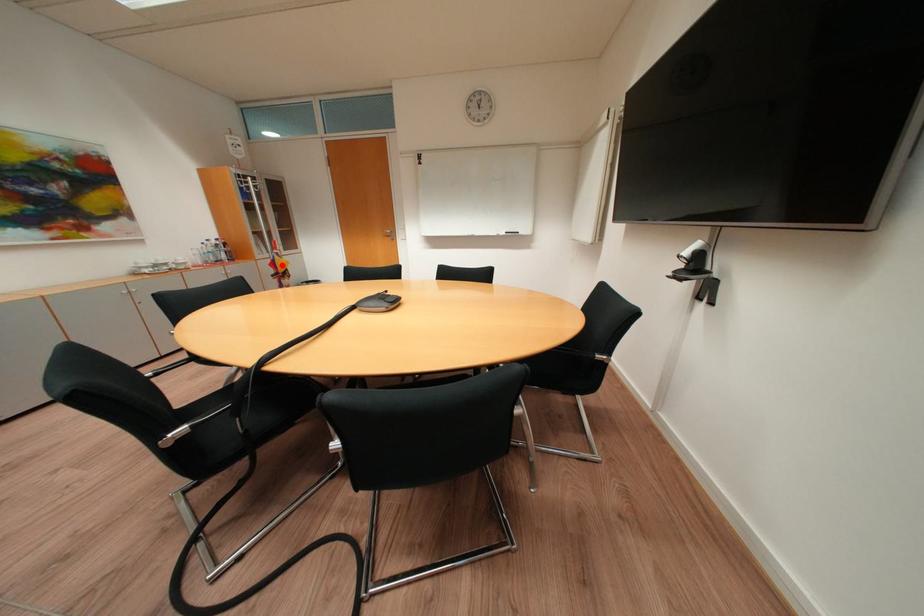
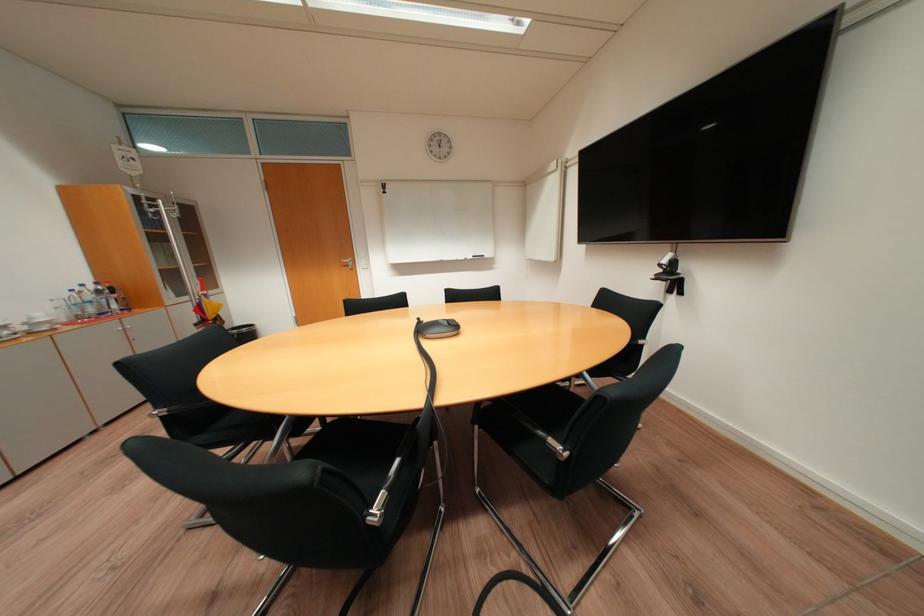
Question: I am providing you with two images of the same scene from different viewpoints. A red point is shown in image1. For the corresponding object point in image2, is it positioned nearer or farther from the camera?

Choices:
 (A) Nearer
 (B) Farther

Answer: (B)